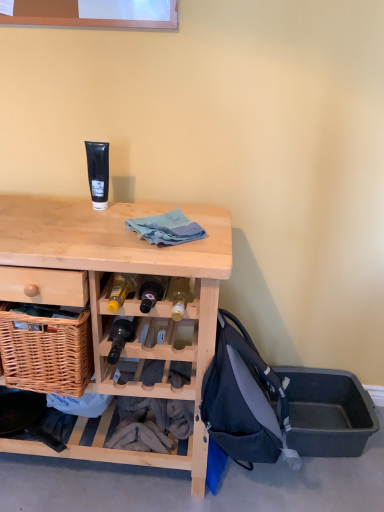
Find the location of `vacant area that is in front of blue cotton cloth at center`. vacant area that is in front of blue cotton cloth at center is located at coordinates (163, 252).